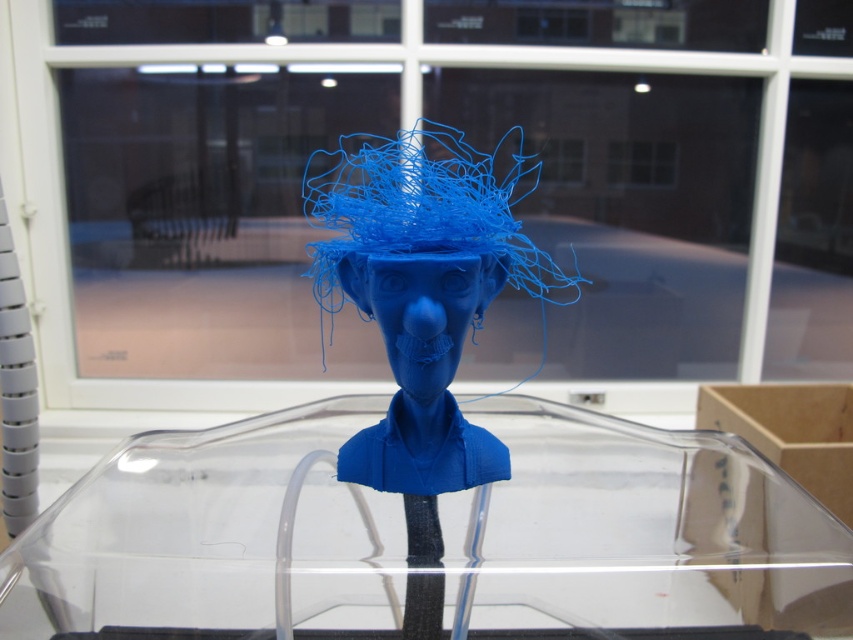
Question: Does transparent plastic container at center have a lesser width compared to matte plastic bust at center?

Choices:
 (A) yes
 (B) no

Answer: (B)

Question: Among these objects, which one is farthest from the camera?

Choices:
 (A) matte plastic bust at center
 (B) matte blue bust at center
 (C) transparent plastic container at center

Answer: (B)

Question: Can you confirm if transparent plastic container at center is thinner than matte plastic bust at center?

Choices:
 (A) no
 (B) yes

Answer: (A)

Question: Among these objects, which one is nearest to the camera?

Choices:
 (A) matte plastic bust at center
 (B) transparent plastic container at center
 (C) matte blue bust at center

Answer: (B)

Question: Which point appears closest to the camera in this image?

Choices:
 (A) (364, 284)
 (B) (173, 556)
 (C) (346, 264)

Answer: (B)

Question: Observing the image, what is the correct spatial positioning of transparent plastic container at center in reference to matte plastic bust at center?

Choices:
 (A) left
 (B) right

Answer: (B)